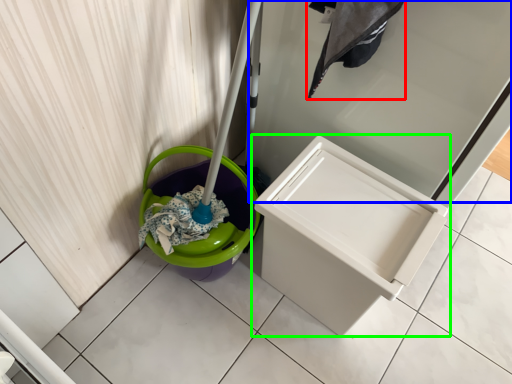
Question: Estimate the real-world distances between objects in this image. Which object is closer to laundry (highlighted by a red box), screen door (highlighted by a blue box) or waste container (highlighted by a green box)?

Choices:
 (A) screen door
 (B) waste container

Answer: (A)